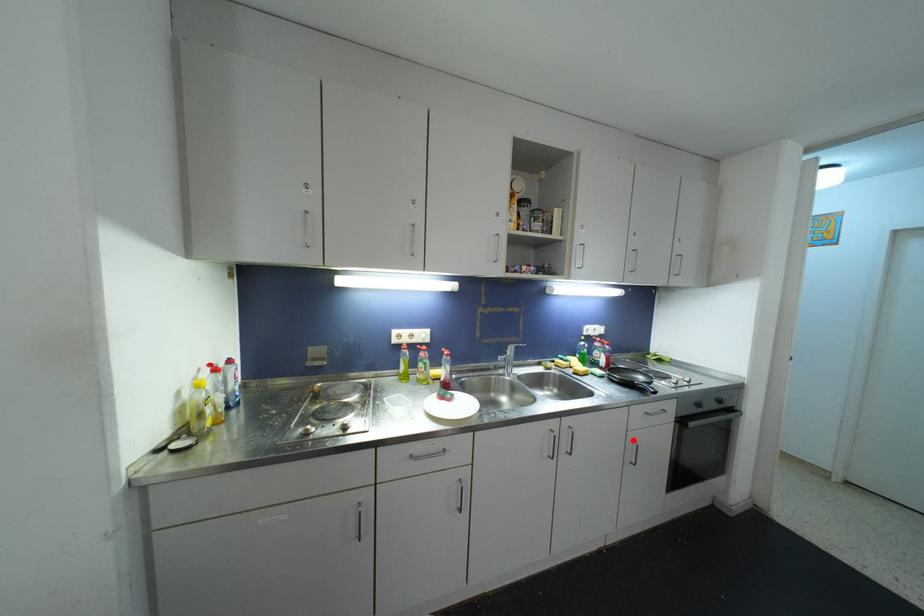
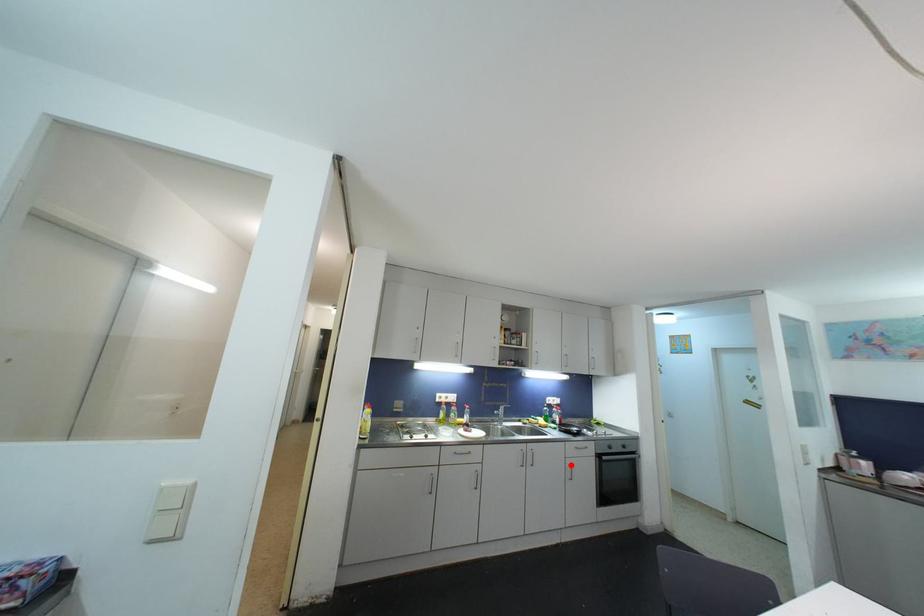
I am providing you with two images of the same scene from different viewpoints. A red point is marked on the first image and another point is marked on the second image. Is the marked point in image1 the same physical position as the marked point in image2?

Yes